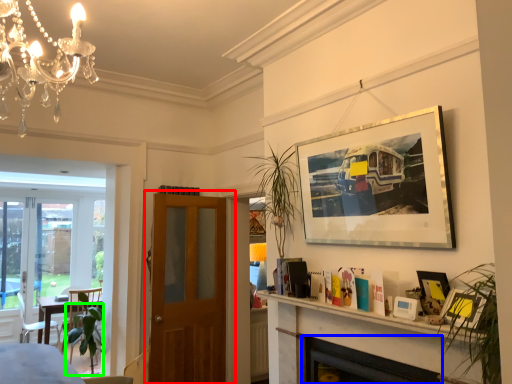
Question: Which is nearer to the door (highlighted by a red box)? fireplace (highlighted by a blue box) or plant (highlighted by a green box).

Choices:
 (A) fireplace
 (B) plant

Answer: (B)